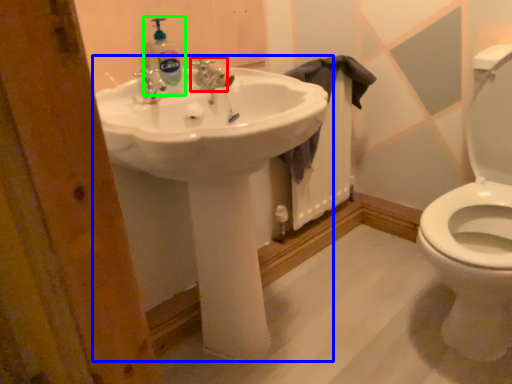
Question: Considering the real-world distances, which object is closest to tap (highlighted by a red box)? sink (highlighted by a blue box) or cleaning product (highlighted by a green box).

Choices:
 (A) sink
 (B) cleaning product

Answer: (B)